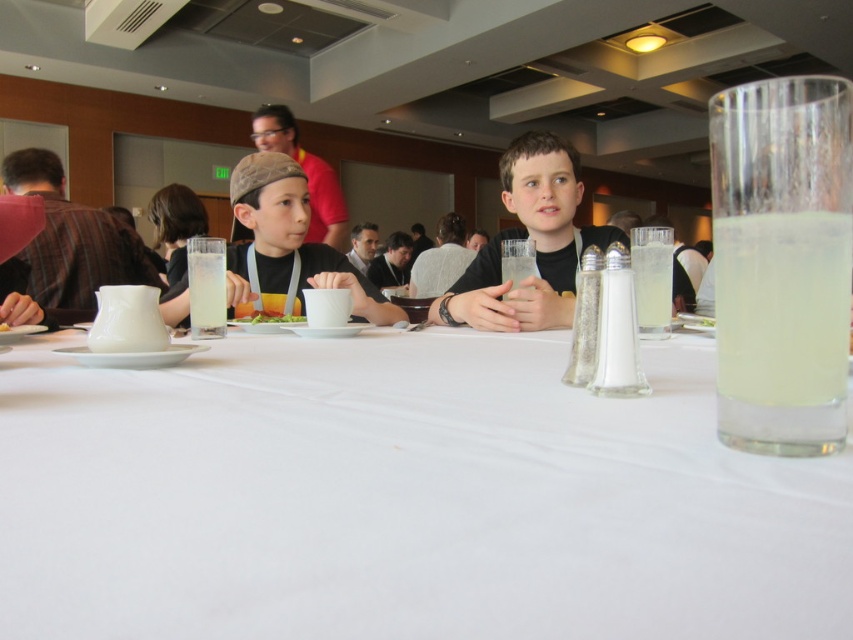
You are standing at the edge of the banquet hall table. You see two points on the table surface labeled as point (273, 120) and point (651, 284). Which point is closer to you?

Point (273, 120) is further to the camera than point (651, 284), so the point closer to you is point (651, 284).

In the scene shown: You are a banquet server who needs to retrieve the clear glass at left for a guest. Can you easily reach it without moving the matte black cap at center?

The clear glass at left is behind the matte black cap at center, so you cannot easily reach it without moving the matte black cap at center first.

You are setting up a banquet hall and need to place a name tag exactly at the coordinates mentioned in the scene description. Where should you place the name tag relative to the matte brown cap at center?

The matte brown cap at center is located at point (305, 172), so you should place the name tag at those coordinates relative to the matte brown cap at center.